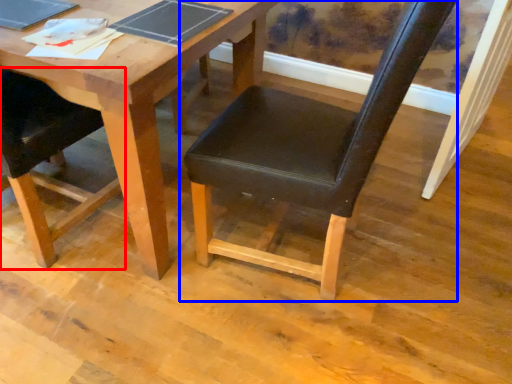
Question: Which point is further to the camera, chair (highlighted by a red box) or chair (highlighted by a blue box)?

Choices:
 (A) chair
 (B) chair

Answer: (A)